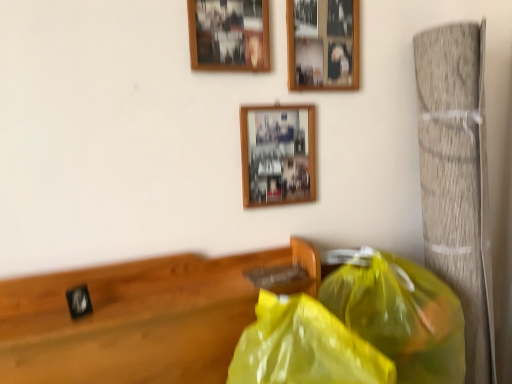
The height and width of the screenshot is (384, 512). What do you see at coordinates (140, 318) in the screenshot? I see `black matte clock at left` at bounding box center [140, 318].

Based on the photo, measure the distance between black matte clock at left and camera.

black matte clock at left is 3.30 feet away from camera.

The width and height of the screenshot is (512, 384). What do you see at coordinates (323, 44) in the screenshot?
I see `wooden photo frame at upper center, placed as the second picture frame when sorted from bottom to top` at bounding box center [323, 44].

You are a GUI agent. You are given a task and a screenshot of the screen. Output one action in this format:
    pyautogui.click(x=<x>, y=<y>)
    Task: Click on the wooden photo frame at upper center, placed as the second picture frame when sorted from bottom to top
    
    Given the screenshot: What is the action you would take?
    pyautogui.click(x=323, y=44)

What do you see at coordinates (401, 315) in the screenshot? The height and width of the screenshot is (384, 512). I see `yellow translucent plastic bag at right, which is the first plastic bag from right to left` at bounding box center [401, 315].

Consider the image. What is the approximate width of wooden picture frame at center, which is the third picture frame from top to bottom?

It is 1.21 inches.

Locate an element on the screen. This screenshot has height=384, width=512. wooden picture frame at upper center, the first picture frame in the top-to-bottom sequence is located at coordinates pos(229,35).

From the image's perspective, is yellow translucent plastic bag at right, which is the second plastic bag in left-to-right order, located above or below wooden picture frame at upper center, the third picture frame from the bottom?

yellow translucent plastic bag at right, which is the second plastic bag in left-to-right order, is situated lower than wooden picture frame at upper center, the third picture frame from the bottom, in the image.

At what (x,y) coordinates should I click in order to perform the action: click on picture frame that is the 3rd one when counting leftward from the yellow translucent plastic bag at right, which is the second plastic bag in left-to-right order. Please return your answer as a coordinate pair (x, y). Looking at the image, I should click on (229, 35).

Is point (403, 315) closer or farther from the camera than point (223, 21)?

Point (403, 315).

What's the angular difference between yellow translucent plastic bag at right, which is the first plastic bag from right to left, and wooden picture frame at upper center, the first picture frame in the top-to-bottom sequence,'s facing directions?

The angular difference between yellow translucent plastic bag at right, which is the first plastic bag from right to left, and wooden picture frame at upper center, the first picture frame in the top-to-bottom sequence, is 26.4 degrees.

In terms of width, does yellow translucent plastic bag at lower right, which is counted as the 2th plastic bag, starting from the right, look wider or thinner when compared to wooden photo frame at upper center, placed as the second picture frame when sorted from bottom to top?

Considering their sizes, yellow translucent plastic bag at lower right, which is counted as the 2th plastic bag, starting from the right, looks broader than wooden photo frame at upper center, placed as the second picture frame when sorted from bottom to top.

Which is correct: yellow translucent plastic bag at lower right, placed as the 1th plastic bag when sorted from left to right, is inside wooden photo frame at upper center, placed as the second picture frame when sorted from bottom to top, or outside of it?

yellow translucent plastic bag at lower right, placed as the 1th plastic bag when sorted from left to right, is spatially situated outside wooden photo frame at upper center, placed as the second picture frame when sorted from bottom to top.

Who is bigger, yellow translucent plastic bag at lower right, placed as the 1th plastic bag when sorted from left to right, or wooden photo frame at upper center, placed as the 2th picture frame when sorted from top to bottom?

yellow translucent plastic bag at lower right, placed as the 1th plastic bag when sorted from left to right.

Locate an element on the screen. This screenshot has height=384, width=512. picture frame to the right of yellow translucent plastic bag at lower right, placed as the 1th plastic bag when sorted from left to right is located at coordinates click(323, 44).

From a real-world perspective, which object stands above the other?

wooden picture frame at center, which is the third picture frame from top to bottom, is physically above.

In terms of width, does wooden picture frame at center, which is the third picture frame from top to bottom, look wider or thinner when compared to black matte clock at left?

Clearly, wooden picture frame at center, which is the third picture frame from top to bottom, has less width compared to black matte clock at left.

Is point (268, 127) farther from camera compared to point (150, 376)?

Yes, it is.

Which is more to the left, wooden picture frame at center, which is the third picture frame from top to bottom, or black matte clock at left?

Positioned to the left is black matte clock at left.

Can you confirm if wooden picture frame at upper center, the first picture frame in the top-to-bottom sequence, is taller than wooden photo frame at upper center, placed as the 2th picture frame when sorted from top to bottom?

Yes, wooden picture frame at upper center, the first picture frame in the top-to-bottom sequence, is taller than wooden photo frame at upper center, placed as the 2th picture frame when sorted from top to bottom.

Is wooden picture frame at upper center, the third picture frame from the bottom, in contact with wooden photo frame at upper center, placed as the second picture frame when sorted from bottom to top?

wooden picture frame at upper center, the third picture frame from the bottom, is not next to wooden photo frame at upper center, placed as the second picture frame when sorted from bottom to top, and they're not touching.

In the scene shown: Can wooden photo frame at upper center, placed as the second picture frame when sorted from bottom to top, be found inside wooden picture frame at upper center, the third picture frame from the bottom?

No.

Can you confirm if wooden photo frame at upper center, placed as the second picture frame when sorted from bottom to top, is thinner than black matte clock at left?

Correct, the width of wooden photo frame at upper center, placed as the second picture frame when sorted from bottom to top, is less than that of black matte clock at left.

Is black matte clock at left inside wooden photo frame at upper center, placed as the 2th picture frame when sorted from top to bottom?

No, black matte clock at left is not inside wooden photo frame at upper center, placed as the 2th picture frame when sorted from top to bottom.

Which of these two, wooden photo frame at upper center, placed as the second picture frame when sorted from bottom to top, or black matte clock at left, stands shorter?

black matte clock at left is shorter.

Would you say wooden photo frame at upper center, placed as the second picture frame when sorted from bottom to top, is a long distance from wooden picture frame at upper center, the first picture frame in the top-to-bottom sequence?

No, wooden photo frame at upper center, placed as the second picture frame when sorted from bottom to top, is not far away from wooden picture frame at upper center, the first picture frame in the top-to-bottom sequence.

From the image's perspective, which object appears higher, wooden photo frame at upper center, placed as the second picture frame when sorted from bottom to top, or wooden picture frame at upper center, the first picture frame in the top-to-bottom sequence?

wooden picture frame at upper center, the first picture frame in the top-to-bottom sequence, appears higher in the image.

Is wooden photo frame at upper center, placed as the second picture frame when sorted from bottom to top, not within wooden picture frame at upper center, the first picture frame in the top-to-bottom sequence?

Indeed, wooden photo frame at upper center, placed as the second picture frame when sorted from bottom to top, is completely outside wooden picture frame at upper center, the first picture frame in the top-to-bottom sequence.

How different are the orientations of wooden photo frame at upper center, placed as the second picture frame when sorted from bottom to top, and wooden picture frame at upper center, the third picture frame from the bottom, in degrees?

The facing directions of wooden photo frame at upper center, placed as the second picture frame when sorted from bottom to top, and wooden picture frame at upper center, the third picture frame from the bottom, are 2.08 degrees apart.

Which object is positioned more to the right, yellow translucent plastic bag at lower right, which is counted as the 2th plastic bag, starting from the right, or wooden picture frame at center, which is the third picture frame from top to bottom?

From the viewer's perspective, yellow translucent plastic bag at lower right, which is counted as the 2th plastic bag, starting from the right, appears more on the right side.

Is yellow translucent plastic bag at lower right, placed as the 1th plastic bag when sorted from left to right, turned away from wooden picture frame at center, the 1th picture frame positioned from the bottom?

No, yellow translucent plastic bag at lower right, placed as the 1th plastic bag when sorted from left to right, is not facing away from wooden picture frame at center, the 1th picture frame positioned from the bottom.

Based on the photo, what's the angular difference between yellow translucent plastic bag at lower right, placed as the 1th plastic bag when sorted from left to right, and wooden picture frame at center, the 1th picture frame positioned from the bottom,'s facing directions?

They differ by 47.8 degrees in their facing directions.

Do you think yellow translucent plastic bag at lower right, placed as the 1th plastic bag when sorted from left to right, is within wooden picture frame at center, which is the third picture frame from top to bottom, or outside of it?

yellow translucent plastic bag at lower right, placed as the 1th plastic bag when sorted from left to right, is spatially situated outside wooden picture frame at center, which is the third picture frame from top to bottom.

This screenshot has width=512, height=384. Identify the location of plastic bag that is the 2nd object to the right of the wooden picture frame at upper center, the first picture frame in the top-to-bottom sequence, starting at the anchor. (401, 315).

The image size is (512, 384). In order to click on plastic bag that is the 1st object directly below the wooden photo frame at upper center, placed as the 2th picture frame when sorted from top to bottom (from a real-world perspective) in this screenshot , I will do point(304,347).

Which object lies further to the anchor point black matte clock at left, yellow translucent plastic bag at lower right, placed as the 1th plastic bag when sorted from left to right, or wooden picture frame at center, the 1th picture frame positioned from the bottom?

wooden picture frame at center, the 1th picture frame positioned from the bottom, is positioned further to the anchor black matte clock at left.

In the scene shown: Based on their spatial positions, is yellow translucent plastic bag at lower right, which is counted as the 2th plastic bag, starting from the right, or yellow translucent plastic bag at right, which is the second plastic bag in left-to-right order, further from wooden picture frame at center, the 1th picture frame positioned from the bottom?

yellow translucent plastic bag at lower right, which is counted as the 2th plastic bag, starting from the right, is positioned further to the anchor wooden picture frame at center, the 1th picture frame positioned from the bottom.

Considering their positions, is wooden photo frame at upper center, placed as the second picture frame when sorted from bottom to top, positioned further to wooden picture frame at center, which is the third picture frame from top to bottom, than wooden picture frame at upper center, the first picture frame in the top-to-bottom sequence?

wooden picture frame at upper center, the first picture frame in the top-to-bottom sequence, is positioned further to the anchor wooden picture frame at center, which is the third picture frame from top to bottom.

Considering their positions, is wooden picture frame at center, which is the third picture frame from top to bottom, positioned further to wooden photo frame at upper center, placed as the 2th picture frame when sorted from top to bottom, than wooden picture frame at upper center, the first picture frame in the top-to-bottom sequence?

Among the two, wooden picture frame at center, which is the third picture frame from top to bottom, is located further to wooden photo frame at upper center, placed as the 2th picture frame when sorted from top to bottom.

Looking at the image, which one is located closer to wooden photo frame at upper center, placed as the 2th picture frame when sorted from top to bottom, black matte clock at left or yellow translucent plastic bag at lower right, placed as the 1th plastic bag when sorted from left to right?

black matte clock at left is positioned closer to the anchor wooden photo frame at upper center, placed as the 2th picture frame when sorted from top to bottom.

Which object lies nearer to the anchor point black matte clock at left, yellow translucent plastic bag at right, which is the first plastic bag from right to left, or yellow translucent plastic bag at lower right, which is counted as the 2th plastic bag, starting from the right?

yellow translucent plastic bag at lower right, which is counted as the 2th plastic bag, starting from the right, lies closer to black matte clock at left than the other object.

When comparing their distances from wooden picture frame at upper center, the third picture frame from the bottom, does wooden picture frame at center, the 1th picture frame positioned from the bottom, or yellow translucent plastic bag at lower right, which is counted as the 2th plastic bag, starting from the right, seem closer?

wooden picture frame at center, the 1th picture frame positioned from the bottom, lies closer to wooden picture frame at upper center, the third picture frame from the bottom, than the other object.

When comparing their distances from yellow translucent plastic bag at right, which is the first plastic bag from right to left, does wooden picture frame at center, which is the third picture frame from top to bottom, or wooden picture frame at upper center, the third picture frame from the bottom, seem further?

wooden picture frame at upper center, the third picture frame from the bottom, lies further to yellow translucent plastic bag at right, which is the first plastic bag from right to left, than the other object.

The height and width of the screenshot is (384, 512). What are the coordinates of `furniture between wooden picture frame at upper center, the first picture frame in the top-to-bottom sequence, and yellow translucent plastic bag at right, which is the first plastic bag from right to left, vertically` in the screenshot? It's located at (140, 318).

You are a GUI agent. You are given a task and a screenshot of the screen. Output one action in this format:
    pyautogui.click(x=<x>, y=<y>)
    Task: Click on the furniture between wooden picture frame at upper center, the third picture frame from the bottom, and yellow translucent plastic bag at lower right, placed as the 1th plastic bag when sorted from left to right, in the up-down direction
    
    Given the screenshot: What is the action you would take?
    pyautogui.click(x=140, y=318)

At what (x,y) coordinates should I click in order to perform the action: click on furniture between wooden photo frame at upper center, placed as the second picture frame when sorted from bottom to top, and yellow translucent plastic bag at lower right, placed as the 1th plastic bag when sorted from left to right, in the vertical direction. Please return your answer as a coordinate pair (x, y). This screenshot has height=384, width=512. Looking at the image, I should click on (140, 318).

Locate an element on the screen. The width and height of the screenshot is (512, 384). picture frame between wooden photo frame at upper center, placed as the 2th picture frame when sorted from top to bottom, and yellow translucent plastic bag at lower right, placed as the 1th plastic bag when sorted from left to right, in the vertical direction is located at coordinates (277, 155).